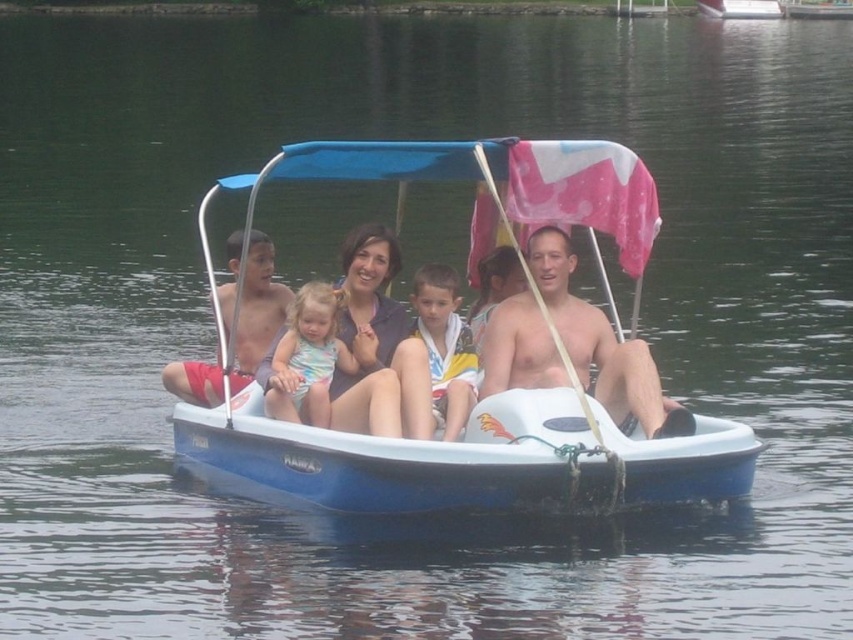
Question: Which point appears closest to the camera in this image?

Choices:
 (A) (733, 497)
 (B) (370, 292)
 (C) (256, 312)
 (D) (312, 378)

Answer: (A)

Question: Estimate the real-world distances between objects in this image. Which object is closer to the pastel floral swimsuit at center?

Choices:
 (A) shiny skin man at center
 (B) multicolored striped towel at center
 (C) blue plastic boat at center

Answer: (B)

Question: Does matte black swimsuit at center appear over matte red shorts at center?

Choices:
 (A) yes
 (B) no

Answer: (B)

Question: Is shiny skin man at center wider than matte red shorts at center?

Choices:
 (A) yes
 (B) no

Answer: (B)

Question: Considering the real-world distances, which object is farthest from the matte red shorts at center?

Choices:
 (A) matte black swimsuit at center
 (B) pastel floral swimsuit at center
 (C) shiny skin man at center
 (D) blue plastic boat at center

Answer: (C)

Question: Is blue plastic boat at center bigger than shiny skin man at center?

Choices:
 (A) yes
 (B) no

Answer: (A)